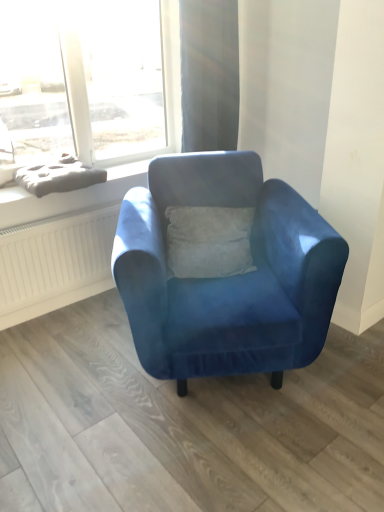
Identify the location of free space in front of velvet blue armchair at center. (218, 456).